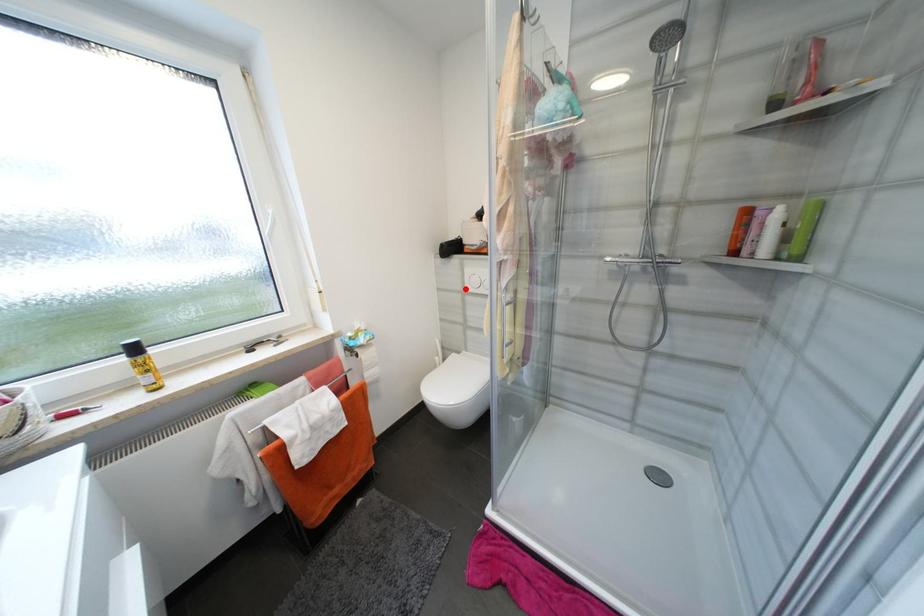
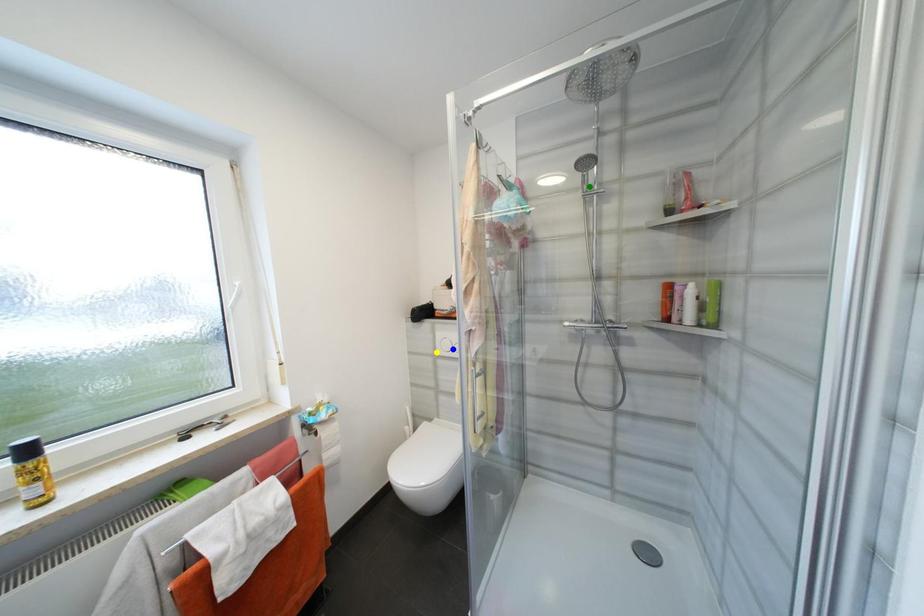
Question: I am providing you with two images of the same scene from different viewpoints. A red point is marked on the first image. You are given multiple points on the second image. Which mark in image 2 goes with the point in image 1?

Choices:
 (A) green point
 (B) blue point
 (C) yellow point

Answer: (C)